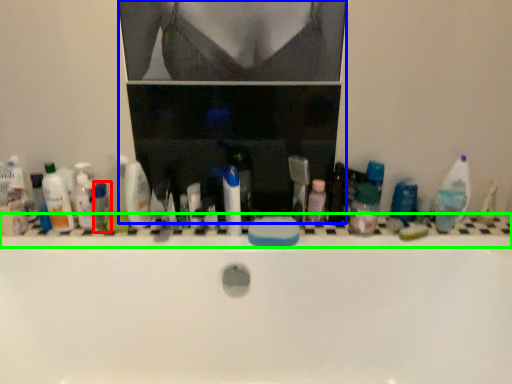
Question: Which object is positioned farthest from toiletry (highlighted by a red box)? Select from medicine cabinet (highlighted by a blue box) and ledge (highlighted by a green box).

Choices:
 (A) medicine cabinet
 (B) ledge

Answer: (B)